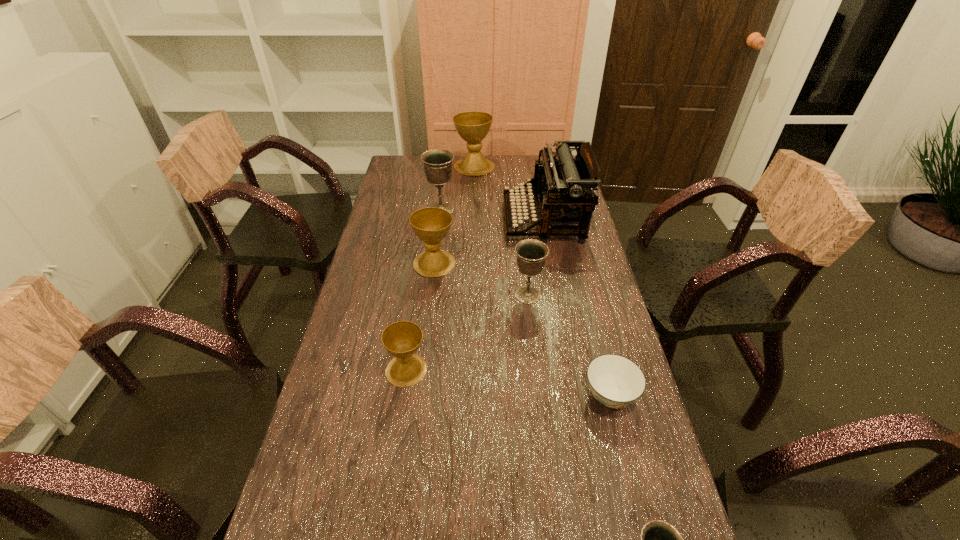
This screenshot has width=960, height=540. What are the coordinates of `typewriter` in the screenshot? It's located at (566, 185).

Identify the location of black typewriter. The width and height of the screenshot is (960, 540). [566, 185].

You are a GUI agent. You are given a task and a screenshot of the screen. Output one action in this format:
    pyautogui.click(x=<x>, y=<y>)
    Task: Click on the farthest object
    The height and width of the screenshot is (540, 960).
    Given the screenshot: What is the action you would take?
    pyautogui.click(x=473, y=127)

Where is `the farthest chalice`? This screenshot has height=540, width=960. the farthest chalice is located at coordinates (473, 127).

Identify the location of the biggest bronze chalice. This screenshot has width=960, height=540. (437, 163).

Where is `the farthest bronze chalice`? Image resolution: width=960 pixels, height=540 pixels. the farthest bronze chalice is located at coordinates (437, 163).

The image size is (960, 540). Identify the location of the second farthest brown chalice. (431, 225).

At what (x,y) coordinates should I click in order to perform the action: click on the second smallest brown chalice. Please return your answer as a coordinate pair (x, y). The image size is (960, 540). Looking at the image, I should click on (431, 225).

Identify the location of the second bronze chalice from left to right. The image size is (960, 540). (531, 253).

This screenshot has height=540, width=960. Find the location of `the second chalice from right to left`. the second chalice from right to left is located at coordinates (531, 253).